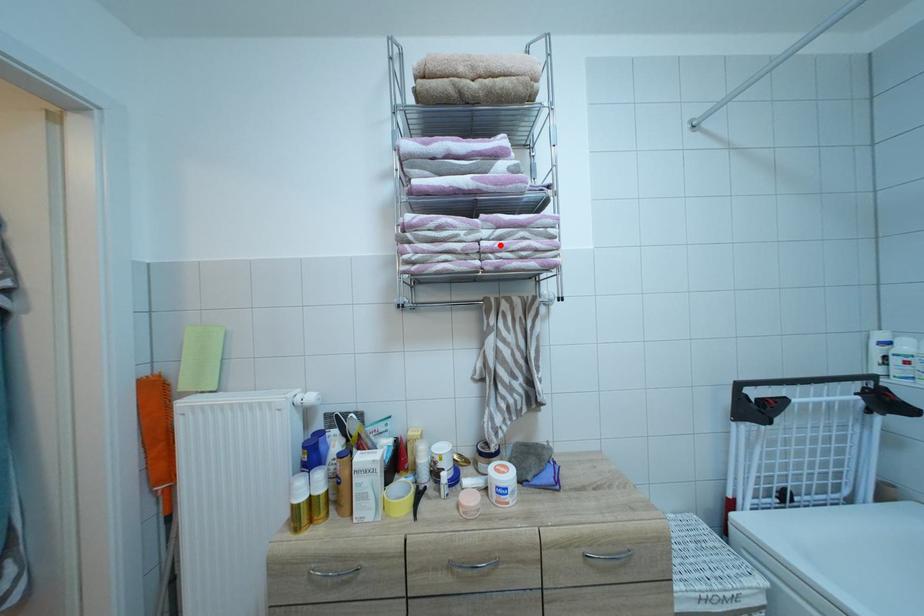
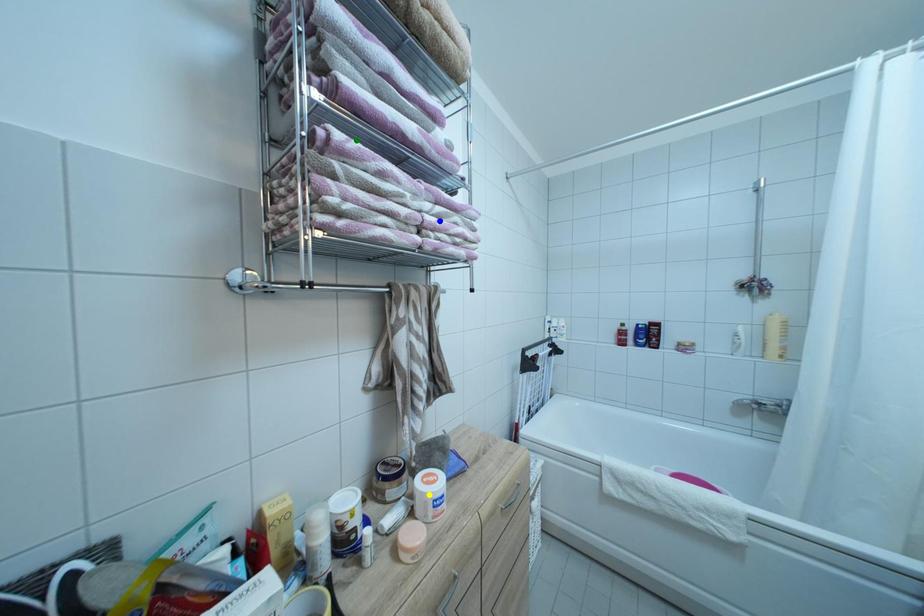
Question: I am providing you with two images of the same scene from different viewpoints. A red point is marked on the first image. You are given multiple points on the second image. Which mark in image 2 goes with the point in image 1?

Choices:
 (A) green point
 (B) blue point
 (C) yellow point

Answer: (B)